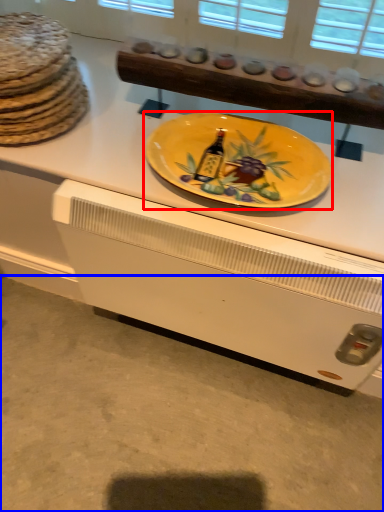
Question: Which point is closer to the camera, plate (highlighted by a red box) or concrete (highlighted by a blue box)?

Choices:
 (A) plate
 (B) concrete

Answer: (A)